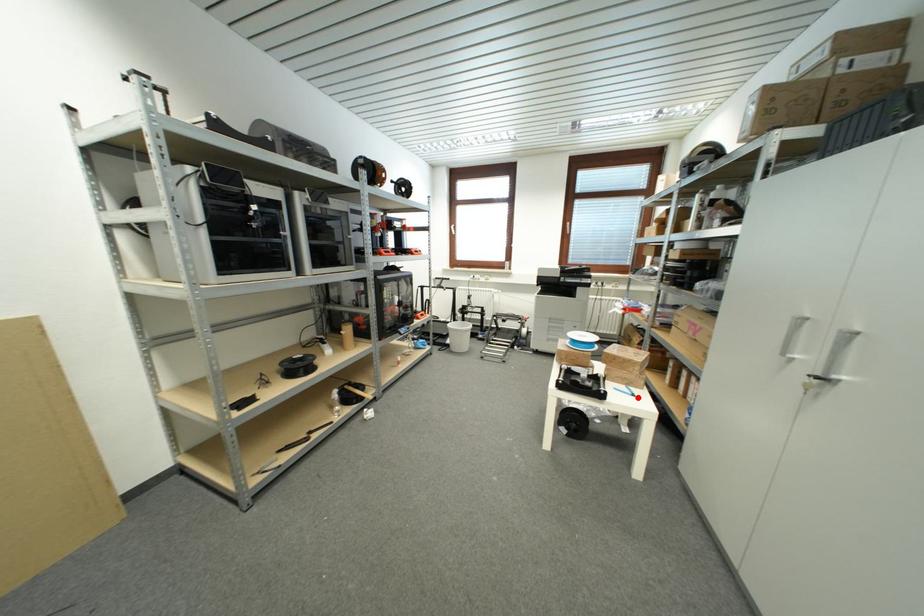
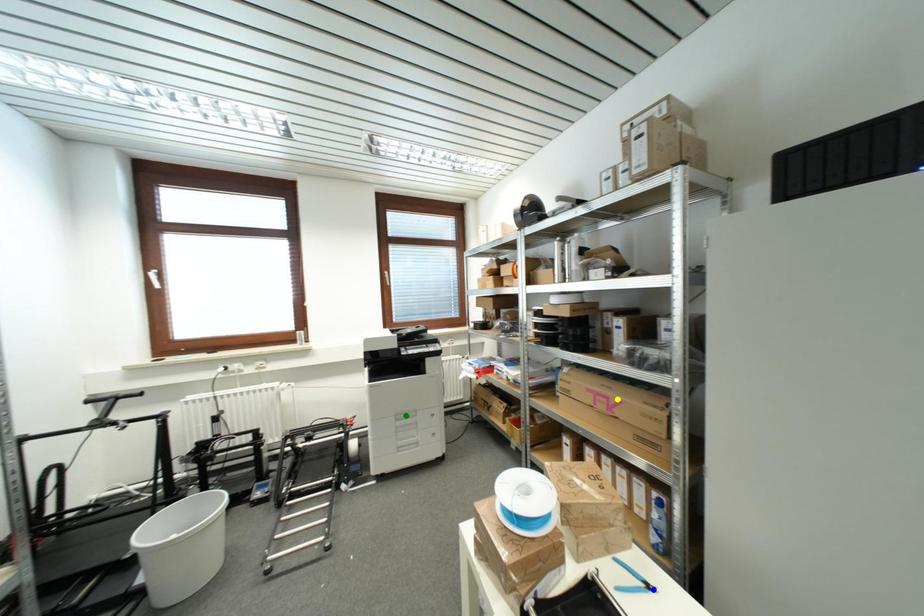
Question: I am providing you with two images of the same scene from different viewpoints. A red point is marked on the first image. You are given multiple points on the second image. Which point in image 2 is actually the same real-world point as the red point in image 1?

Choices:
 (A) green point
 (B) blue point
 (C) yellow point

Answer: (B)